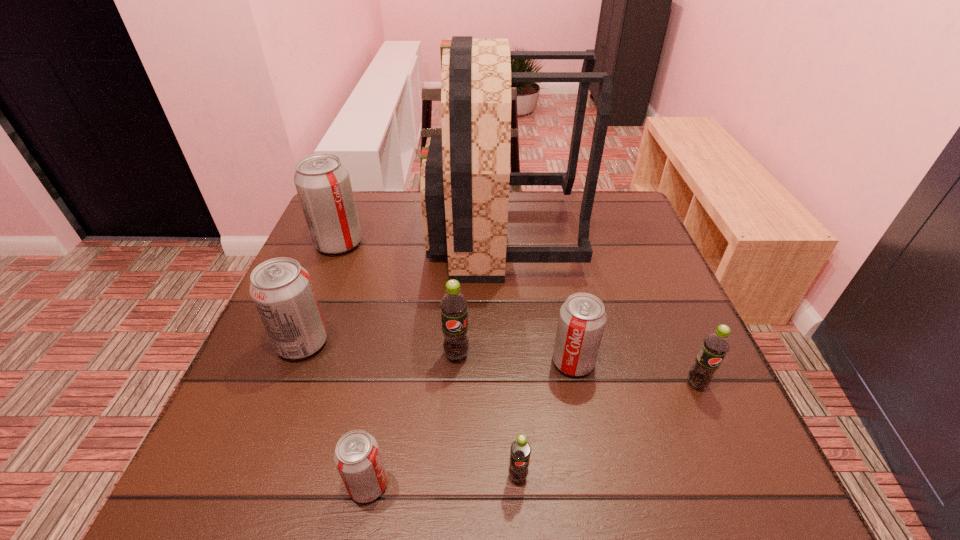
You are a GUI agent. You are given a task and a screenshot of the screen. Output one action in this format:
    pyautogui.click(x=<x>, y=<y>)
    Task: Click on the tallest object
    This screenshot has width=960, height=540.
    Given the screenshot: What is the action you would take?
    pyautogui.click(x=465, y=173)

The height and width of the screenshot is (540, 960). Identify the location of the tallest soda can. (322, 182).

This screenshot has width=960, height=540. I want to click on the biggest gray soda can, so click(322, 182).

You are a GUI agent. You are given a task and a screenshot of the screen. Output one action in this format:
    pyautogui.click(x=<x>, y=<y>)
    Task: Click on the farthest green soda
    
    Given the screenshot: What is the action you would take?
    pyautogui.click(x=454, y=306)

I want to click on the leftmost green soda, so click(x=454, y=306).

Find the location of `the third smallest gray soda can`. the third smallest gray soda can is located at coordinates (282, 291).

At what (x,y) coordinates should I click in order to perform the action: click on the rightmost gray soda can. Please return your answer as a coordinate pair (x, y). This screenshot has width=960, height=540. Looking at the image, I should click on (582, 318).

Where is `the sixth soda can from left to right`? The width and height of the screenshot is (960, 540). the sixth soda can from left to right is located at coordinates (582, 318).

Where is `the rightmost object`? This screenshot has width=960, height=540. the rightmost object is located at coordinates [715, 346].

You are a GUI agent. You are given a task and a screenshot of the screen. Output one action in this format:
    pyautogui.click(x=<x>, y=<y>)
    Task: Click on the second biggest green soda
    The width and height of the screenshot is (960, 540).
    Given the screenshot: What is the action you would take?
    pyautogui.click(x=715, y=346)